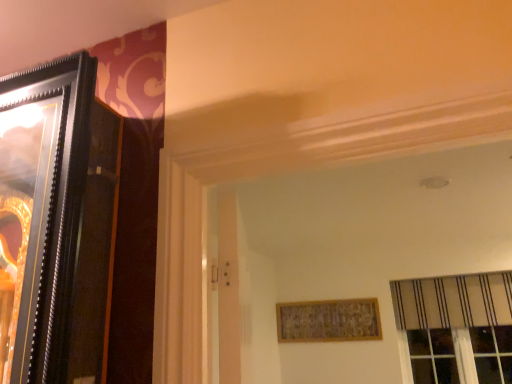
This screenshot has height=384, width=512. What do you see at coordinates (42, 210) in the screenshot?
I see `black glossy picture frame at left` at bounding box center [42, 210].

Where is `black glossy picture frame at left`? black glossy picture frame at left is located at coordinates (42, 210).

Where is `black glossy picture frame at left`? This screenshot has width=512, height=384. black glossy picture frame at left is located at coordinates click(x=42, y=210).